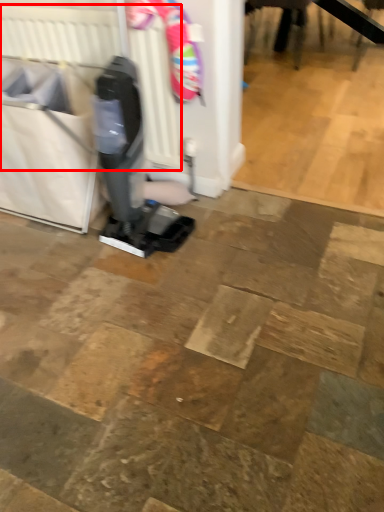
Question: From the image's perspective, where is radiator (annotated by the red box) located in relation to laundry basket in the image?

Choices:
 (A) above
 (B) below

Answer: (A)